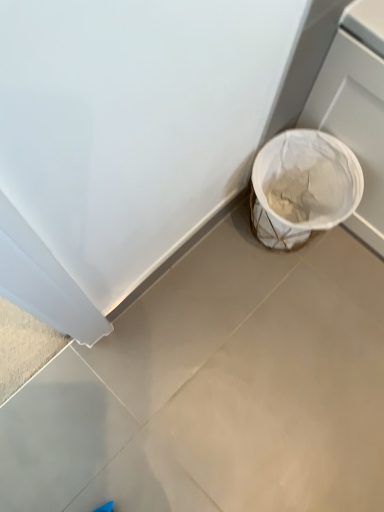
What do you see at coordinates (216, 390) in the screenshot? Image resolution: width=384 pixels, height=512 pixels. I see `white matte trash can at lower right` at bounding box center [216, 390].

Locate an element on the screen. The image size is (384, 512). white matte trash can at lower right is located at coordinates (216, 390).

Where is `white woven basket at lower right`? The image size is (384, 512). white woven basket at lower right is located at coordinates (302, 187).

The image size is (384, 512). What do you see at coordinates (302, 187) in the screenshot? I see `white woven basket at lower right` at bounding box center [302, 187].

Where is `white matte trash can at lower right`? This screenshot has height=512, width=384. white matte trash can at lower right is located at coordinates (216, 390).

Does white woven basket at lower right appear on the right side of white matte trash can at lower right?

Yes.

From the picture: Does white woven basket at lower right lie behind white matte trash can at lower right?

Yes, white woven basket at lower right is behind white matte trash can at lower right.

Does point (304, 177) lie behind point (25, 482)?

Yes, it is.

From the image's perspective, is white woven basket at lower right over white matte trash can at lower right?

Yes, from the image's perspective, white woven basket at lower right is above white matte trash can at lower right.

From a real-world perspective, is white woven basket at lower right physically below white matte trash can at lower right?

Incorrect, from a real-world perspective, white woven basket at lower right is higher than white matte trash can at lower right.

Can you confirm if white woven basket at lower right is thinner than white matte trash can at lower right?

Indeed, white woven basket at lower right has a lesser width compared to white matte trash can at lower right.

Does white woven basket at lower right have a lesser height compared to white matte trash can at lower right?

No, white woven basket at lower right is not shorter than white matte trash can at lower right.

Is white woven basket at lower right bigger or smaller than white matte trash can at lower right?

Clearly, white woven basket at lower right is larger in size than white matte trash can at lower right.

Consider the image. Would you say white woven basket at lower right is inside or outside white matte trash can at lower right?

white woven basket at lower right exists outside the volume of white matte trash can at lower right.

Would you consider white woven basket at lower right to be distant from white matte trash can at lower right?

They are positioned close to each other.

Could you tell me if white woven basket at lower right is facing white matte trash can at lower right?

No, white woven basket at lower right is not oriented towards white matte trash can at lower right.

How many degrees apart are the facing directions of white woven basket at lower right and white matte trash can at lower right?

90.9 degrees separate the facing orientations of white woven basket at lower right and white matte trash can at lower right.

Locate an element on the screen. This screenshot has width=384, height=512. waste container behind the white matte trash can at lower right is located at coordinates (302, 187).

Which object is positioned more to the left, white matte trash can at lower right or white woven basket at lower right?

Positioned to the left is white matte trash can at lower right.

Is white matte trash can at lower right closer to camera compared to white woven basket at lower right?

Yes, the depth of white matte trash can at lower right is less than that of white woven basket at lower right.

Is point (243, 433) in front of point (332, 176)?

Yes, it is.

From the image's perspective, between white matte trash can at lower right and white woven basket at lower right, who is located below?

white matte trash can at lower right is shown below in the image.

From a real-world perspective, is white matte trash can at lower right located beneath white woven basket at lower right?

Indeed, from a real-world perspective, white matte trash can at lower right is positioned beneath white woven basket at lower right.

Between white matte trash can at lower right and white woven basket at lower right, which one has smaller width?

Thinner between the two is white woven basket at lower right.

Considering the sizes of objects white matte trash can at lower right and white woven basket at lower right in the image provided, who is shorter, white matte trash can at lower right or white woven basket at lower right?

white matte trash can at lower right is shorter.

Between white matte trash can at lower right and white woven basket at lower right, which one has larger size?

white woven basket at lower right is bigger.

Is white matte trash can at lower right inside or outside of white woven basket at lower right?

white matte trash can at lower right is located beyond the bounds of white woven basket at lower right.

Is the surface of white matte trash can at lower right in direct contact with white woven basket at lower right?

There is a gap between white matte trash can at lower right and white woven basket at lower right.

Is white matte trash can at lower right facing away from white woven basket at lower right?

white matte trash can at lower right does not have its back to white woven basket at lower right.

How different are the orientations of white matte trash can at lower right and white woven basket at lower right in degrees?

There is a 90.9-degree angle between the facing directions of white matte trash can at lower right and white woven basket at lower right.

How far apart are white matte trash can at lower right and white woven basket at lower right?

white matte trash can at lower right and white woven basket at lower right are 13.47 inches apart.

Locate an element on the screen. This screenshot has height=512, width=384. waste container that is above the white matte trash can at lower right (from a real-world perspective) is located at coordinates (302, 187).

What are the coordinates of `concrete beneath the white woven basket at lower right (from a real-world perspective)` in the screenshot? It's located at (216, 390).

Find the location of a particular element. concrete located on the left of white woven basket at lower right is located at coordinates (216, 390).